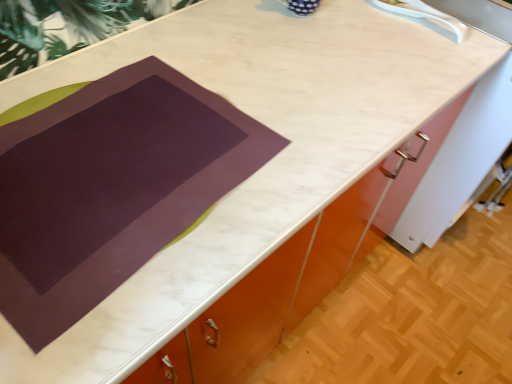
Question: Is white plastic sink at upper right smaller than purple matte placemat at center?

Choices:
 (A) no
 (B) yes

Answer: (B)

Question: Is white plastic sink at upper right located outside purple matte placemat at center?

Choices:
 (A) no
 (B) yes

Answer: (B)

Question: Could purple matte placemat at center be considered to be inside white plastic sink at upper right?

Choices:
 (A) no
 (B) yes

Answer: (A)

Question: Is white plastic sink at upper right closer to the viewer compared to purple matte placemat at center?

Choices:
 (A) no
 (B) yes

Answer: (A)

Question: From a real-world perspective, is white plastic sink at upper right positioned under purple matte placemat at center based on gravity?

Choices:
 (A) no
 (B) yes

Answer: (A)

Question: Is white plastic sink at upper right beside purple matte placemat at center?

Choices:
 (A) no
 (B) yes

Answer: (A)

Question: Is purple matte placemat at center not near white plastic sink at upper right?

Choices:
 (A) yes
 (B) no

Answer: (B)

Question: Is purple matte placemat at center positioned in front of white plastic sink at upper right?

Choices:
 (A) no
 (B) yes

Answer: (B)

Question: Is purple matte placemat at center facing towards white plastic sink at upper right?

Choices:
 (A) no
 (B) yes

Answer: (A)

Question: Can we say purple matte placemat at center lies outside white plastic sink at upper right?

Choices:
 (A) no
 (B) yes

Answer: (B)

Question: Is purple matte placemat at center placed right next to white plastic sink at upper right?

Choices:
 (A) no
 (B) yes

Answer: (A)

Question: From a real-world perspective, is purple matte placemat at center positioned under white plastic sink at upper right based on gravity?

Choices:
 (A) no
 (B) yes

Answer: (B)

Question: Considering their positions, is purple matte placemat at center located in front of or behind white plastic sink at upper right?

Choices:
 (A) behind
 (B) front

Answer: (B)